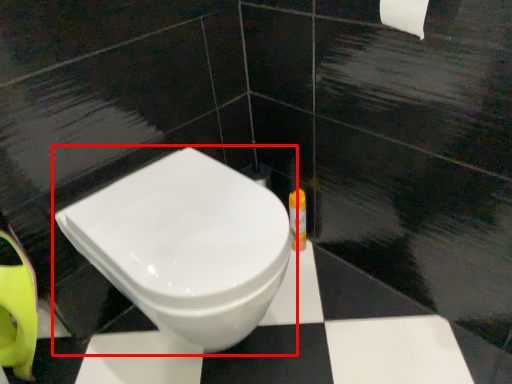
Question: From the image's perspective, considering the relative positions of toilet (annotated by the red box) and toiletry in the image provided, where is toilet (annotated by the red box) located with respect to the staircase?

Choices:
 (A) above
 (B) below

Answer: (B)